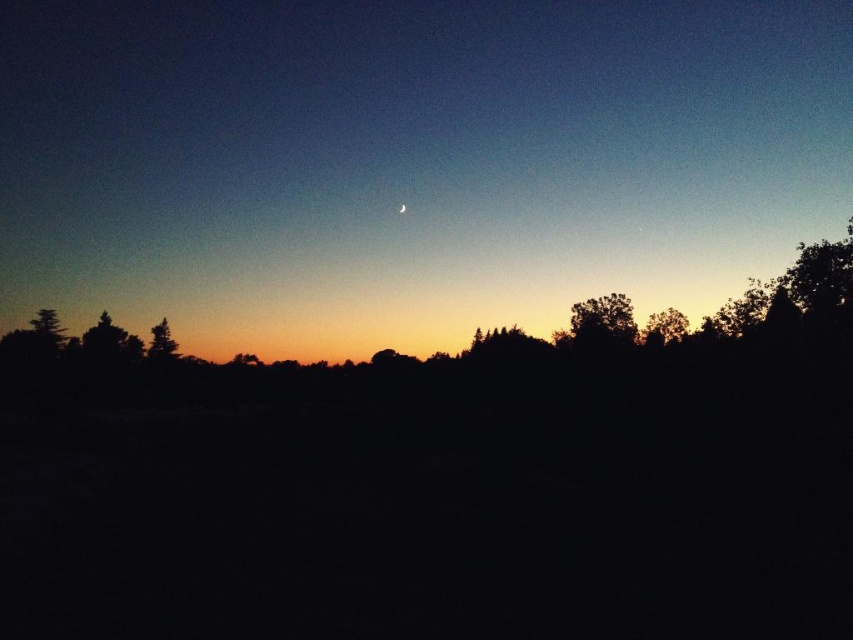
Which is above, green matte tree at left or bright silver crescent at upper center?

bright silver crescent at upper center is above.

Does green matte tree at left appear under bright silver crescent at upper center?

Yes.

Based on the photo, who is more distant from viewer, (x=38, y=310) or (x=398, y=205)?

The point (x=398, y=205) is behind.

You are a GUI agent. You are given a task and a screenshot of the screen. Output one action in this format:
    pyautogui.click(x=<x>, y=<y>)
    Task: Click on the green matte tree at left
    This screenshot has width=853, height=640.
    Given the screenshot: What is the action you would take?
    pyautogui.click(x=47, y=326)

Between green leafy tree at right and bright silver crescent at upper center, which one has more height?

green leafy tree at right is taller.

Does green leafy tree at right have a smaller size compared to bright silver crescent at upper center?

Incorrect, green leafy tree at right is not smaller in size than bright silver crescent at upper center.

Does point (643, 330) come farther from viewer compared to point (399, 211)?

No, (643, 330) is closer to viewer.

Where is `green leafy tree at right`? green leafy tree at right is located at coordinates click(x=664, y=326).

Between point (486, 324) and point (641, 333), which one is positioned in front?

Point (641, 333)

Which is behind, point (519, 275) or point (676, 333)?

The point (519, 275) is more distant.

Where is `silvery crescent moon at center`? The height and width of the screenshot is (640, 853). silvery crescent moon at center is located at coordinates (409, 163).